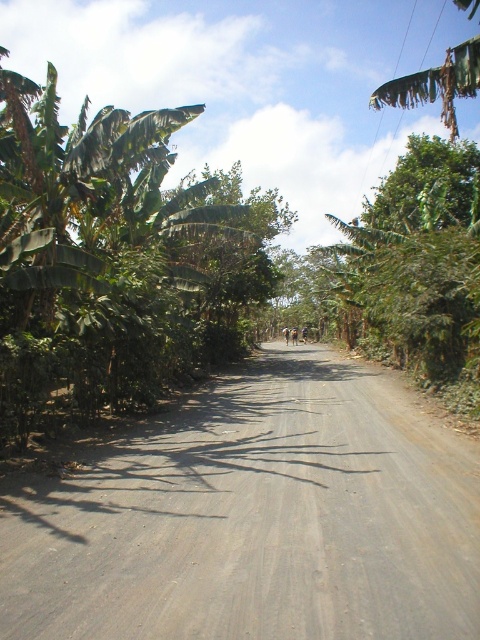
Is green leafy banana tree at left to the right of green leafy tree at center from the viewer's perspective?

No, green leafy banana tree at left is not to the right of green leafy tree at center.

Which is behind, point (177, 236) or point (351, 237)?

Point (351, 237)

Where is `green leafy banana tree at left`? The width and height of the screenshot is (480, 640). green leafy banana tree at left is located at coordinates (113, 260).

Can you confirm if gray gravel road at center is thinner than green leafy banana tree at left?

Yes, gray gravel road at center is thinner than green leafy banana tree at left.

In the scene shown: Can you confirm if gray gravel road at center is positioned above green leafy banana tree at left?

Actually, gray gravel road at center is below green leafy banana tree at left.

Does point (182, 458) lie behind point (191, 244)?

No, (182, 458) is closer to viewer.

This screenshot has height=640, width=480. I want to click on gray gravel road at center, so click(255, 518).

Which of these two, gray gravel road at center or green leafy tree at center, stands shorter?

gray gravel road at center

Is point (60, 616) less distant than point (456, 163)?

Yes, it is.

Is point (121, 448) behind point (419, 344)?

No, (121, 448) is in front of (419, 344).

What are the coordinates of `gray gravel road at center` in the screenshot? It's located at (255, 518).